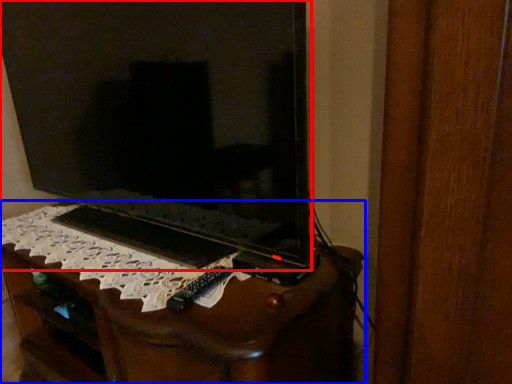
Question: Which object is further to the camera taking this photo, television (highlighted by a red box) or furniture (highlighted by a blue box)?

Choices:
 (A) television
 (B) furniture

Answer: (B)